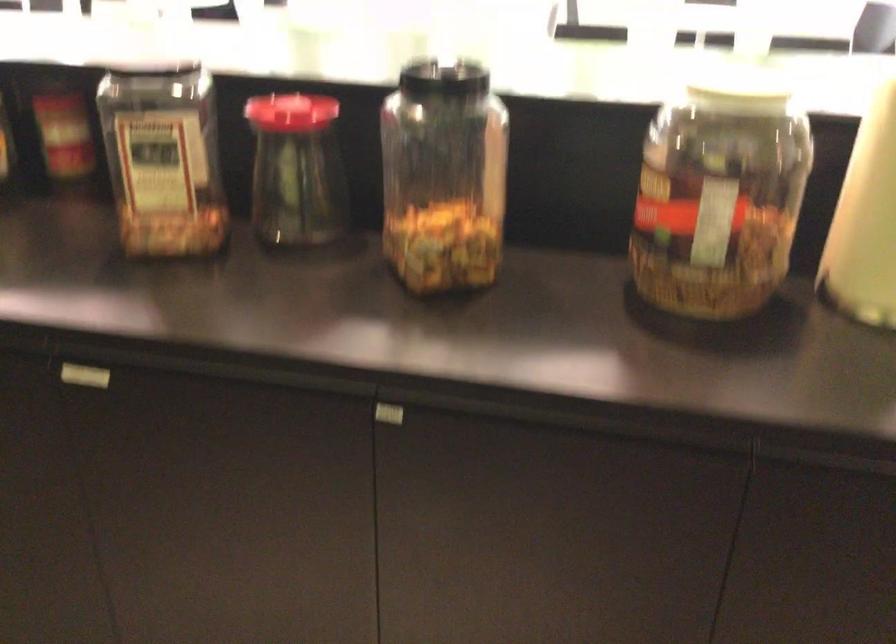
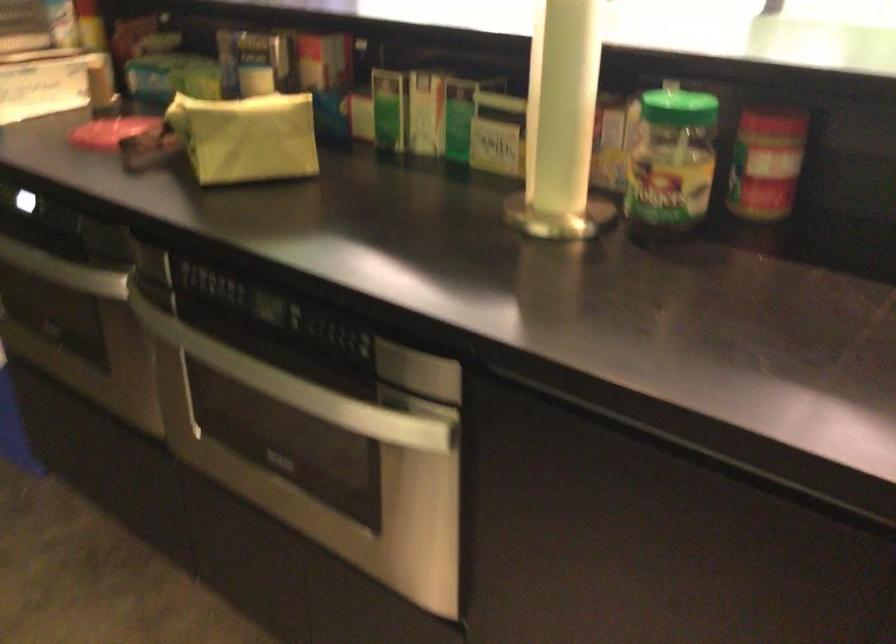
Which direction would the cameraman need to move to produce the second image?

The movement direction of the cameraman is left, forward.